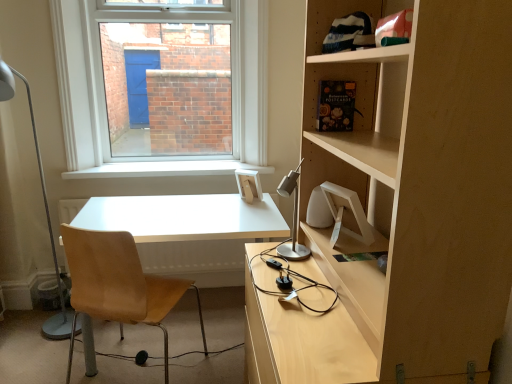
Find the location of `vacant space underneath white matte desk at center (from a real-world perspective)`. vacant space underneath white matte desk at center (from a real-world perspective) is located at coordinates (215, 334).